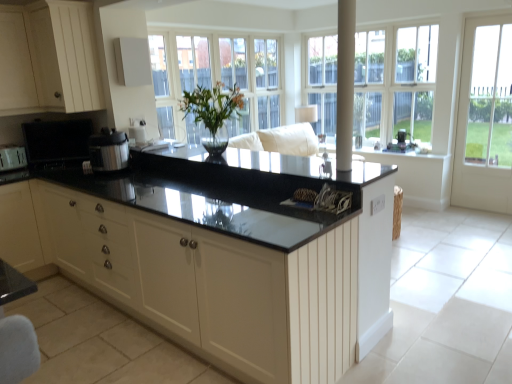
Question: Should I look upward or downward to see clear glass windows at upper center?

Choices:
 (A) up
 (B) down

Answer: (A)

Question: Is clear glass windows at upper center wider than black granite countertop at center, the 1th countertop in the top-to-bottom sequence?

Choices:
 (A) yes
 (B) no

Answer: (B)

Question: Can you confirm if clear glass windows at upper center is positioned to the left of black granite countertop at center, arranged as the 2th countertop when ordered from the bottom?

Choices:
 (A) yes
 (B) no

Answer: (B)

Question: From a real-world perspective, does clear glass windows at upper center sit lower than black granite countertop at center, arranged as the 2th countertop when ordered from the bottom?

Choices:
 (A) no
 (B) yes

Answer: (A)

Question: From the image's perspective, does clear glass windows at upper center appear lower than black granite countertop at center, the 1th countertop in the top-to-bottom sequence?

Choices:
 (A) no
 (B) yes

Answer: (A)

Question: From the image's perspective, is clear glass windows at upper center on black granite countertop at center, arranged as the 2th countertop when ordered from the bottom?

Choices:
 (A) yes
 (B) no

Answer: (A)

Question: Is the depth of clear glass windows at upper center less than that of black granite countertop at center, the 1th countertop in the top-to-bottom sequence?

Choices:
 (A) yes
 (B) no

Answer: (B)

Question: Is black granite countertop at center, arranged as the 2th countertop when ordered from the bottom, closer to the viewer compared to satin black speaker at upper right, acting as the 1th appliance starting from the right?

Choices:
 (A) no
 (B) yes

Answer: (B)

Question: Does black granite countertop at center, the 1th countertop in the top-to-bottom sequence, have a larger size compared to satin black speaker at upper right, positioned as the fourth appliance in front-to-back order?

Choices:
 (A) no
 (B) yes

Answer: (B)

Question: Is black granite countertop at center, arranged as the 2th countertop when ordered from the bottom, completely or partially outside of satin black speaker at upper right, acting as the 1th appliance starting from the right?

Choices:
 (A) no
 (B) yes

Answer: (B)

Question: Does black granite countertop at center, the 1th countertop in the top-to-bottom sequence, appear on the left side of satin black speaker at upper right, acting as the 1th appliance starting from the right?

Choices:
 (A) no
 (B) yes

Answer: (B)

Question: Is black granite countertop at center, the 1th countertop in the top-to-bottom sequence, shorter than satin black speaker at upper right, acting as the 1th appliance starting from the right?

Choices:
 (A) no
 (B) yes

Answer: (B)

Question: Does black granite countertop at center, the 1th countertop in the top-to-bottom sequence, touch satin black speaker at upper right, acting as the 1th appliance starting from the right?

Choices:
 (A) yes
 (B) no

Answer: (B)

Question: From the image's perspective, is satin silver pressure cooker at center, marked as the 3th appliance in a left-to-right arrangement, beneath clear glass windows at upper center?

Choices:
 (A) no
 (B) yes

Answer: (B)